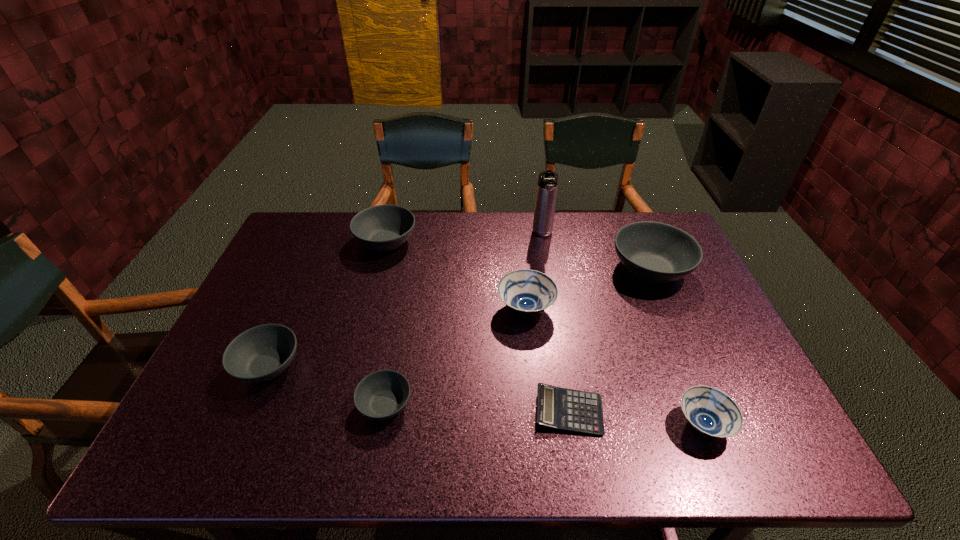
This screenshot has height=540, width=960. Identify the location of the smallest gray soup bowl. (380, 395).

This screenshot has height=540, width=960. What are the coordinates of `the second shortest object` in the screenshot? It's located at (380, 395).

I want to click on the shortest object, so coord(559,408).

Identify the location of free location located on the handle side of the thermos bottle. (555, 303).

In order to click on vacant point located 0.400m on the left of the rightmost gray soup bowl in this screenshot , I will do `click(482, 269)`.

This screenshot has height=540, width=960. Identify the location of free space located 0.270m on the right of the third smallest gray soup bowl. (497, 241).

Where is `blank area located 0.350m on the front of the left blue soup bowl`? Image resolution: width=960 pixels, height=540 pixels. blank area located 0.350m on the front of the left blue soup bowl is located at coordinates (541, 457).

Where is `vacant area located on the right of the leftmost object`? The image size is (960, 540). vacant area located on the right of the leftmost object is located at coordinates (442, 366).

Where is `vacant space positioned 0.050m on the right of the nearer blue soup bowl`? Image resolution: width=960 pixels, height=540 pixels. vacant space positioned 0.050m on the right of the nearer blue soup bowl is located at coordinates (754, 424).

This screenshot has height=540, width=960. Identify the location of vacant space positioned 0.160m on the right of the shortest soup bowl. (481, 404).